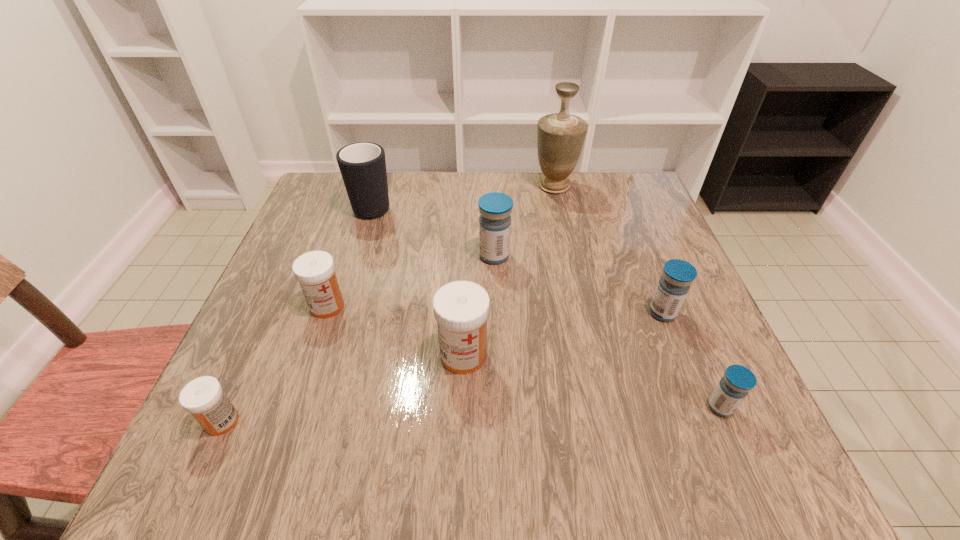
At what (x,y) coordinates should I click in order to perform the action: click on the nearest blue medicine. Please return your answer as a coordinate pair (x, y). Image resolution: width=960 pixels, height=540 pixels. Looking at the image, I should click on (734, 386).

You are a GUI agent. You are given a task and a screenshot of the screen. Output one action in this format:
    pyautogui.click(x=<x>, y=<y>)
    Task: Click on the smallest white medicine
    Image resolution: width=960 pixels, height=540 pixels.
    Given the screenshot: What is the action you would take?
    pyautogui.click(x=203, y=397)

You are a GUI agent. You are given a task and a screenshot of the screen. Output one action in this format:
    pyautogui.click(x=<x>, y=<y>)
    Task: Click on the leftmost white medicine
    The width and height of the screenshot is (960, 540).
    Given the screenshot: What is the action you would take?
    pyautogui.click(x=203, y=397)

This screenshot has width=960, height=540. In order to click on vacant space located 0.240m on the front of the urn in this screenshot , I will do `click(570, 258)`.

Image resolution: width=960 pixels, height=540 pixels. Find the location of `free space located 0.070m on the side of the mug with the handle`. free space located 0.070m on the side of the mug with the handle is located at coordinates (382, 174).

The image size is (960, 540). Identify the location of free location located 0.350m on the left of the biggest blue medicine. (328, 255).

The image size is (960, 540). I want to click on free region located on the back of the sixth farthest object, so click(x=465, y=309).

Locate an element on the screen. Image resolution: width=960 pixels, height=540 pixels. free point located 0.180m on the front of the second smallest blue medicine is located at coordinates (699, 405).

At what (x,y) coordinates should I click in order to perform the action: click on vacant space positioned on the front of the farthest white medicine. Please return your answer as a coordinate pair (x, y). The image size is (960, 540). Looking at the image, I should click on point(296,400).

The height and width of the screenshot is (540, 960). Find the location of `vacant space located 0.300m on the back of the nearest blue medicine`. vacant space located 0.300m on the back of the nearest blue medicine is located at coordinates (663, 275).